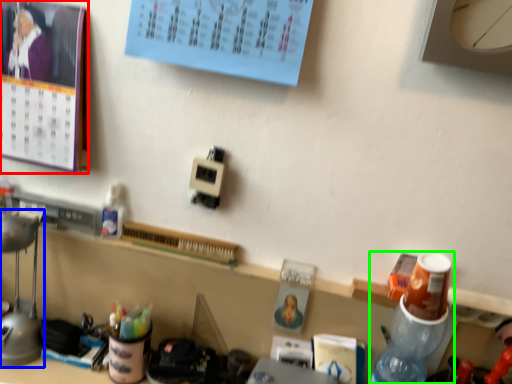
Question: Considering the real-world distances, which object is farthest from bulletin board (highlighted by a red box)? lamp (highlighted by a blue box) or bottle (highlighted by a green box)?

Choices:
 (A) lamp
 (B) bottle

Answer: (B)